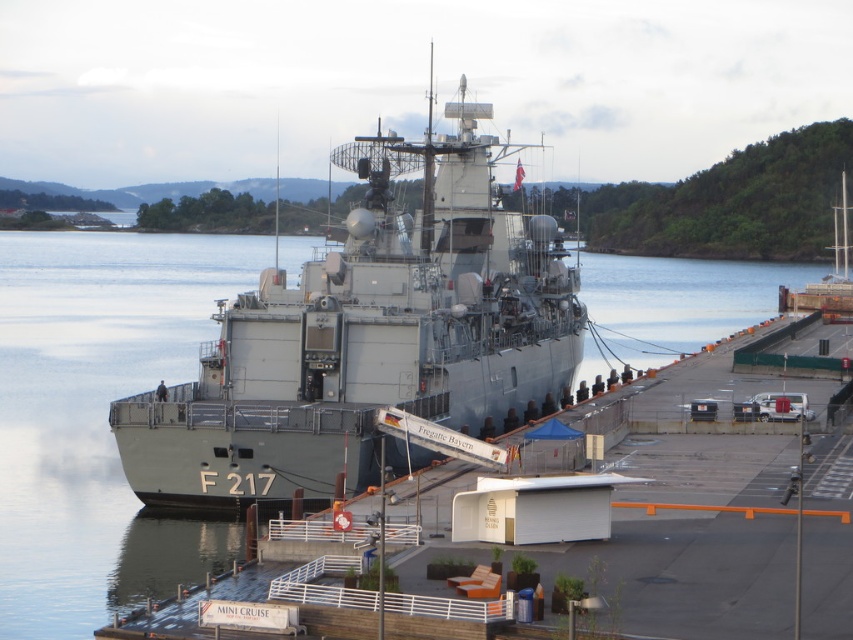
Does gray metallic ship at center come in front of gray metallic water at center?

No.

Who is higher up, gray metallic ship at center or gray metallic water at center?

gray metallic ship at center is higher up.

Image resolution: width=853 pixels, height=640 pixels. I want to click on gray metallic ship at center, so click(x=368, y=337).

Identify the location of gray metallic ship at center. The height and width of the screenshot is (640, 853). (368, 337).